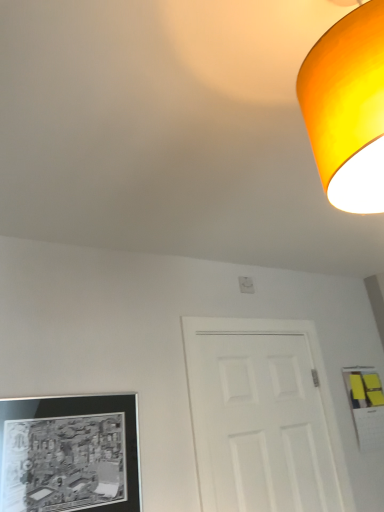
Question: Is point (349, 195) positioned closer to the camera than point (24, 490)?

Choices:
 (A) closer
 (B) farther

Answer: (A)

Question: In the image, is matte orange lampshade at upper right on the left side or the right side of black matte picture frame at lower left?

Choices:
 (A) right
 (B) left

Answer: (A)

Question: Considering the real-world distances, which object is farthest from the black matte picture frame at lower left?

Choices:
 (A) white matte door at center
 (B) matte orange lampshade at upper right

Answer: (B)

Question: Estimate the real-world distances between objects in this image. Which object is closer to the black matte picture frame at lower left?

Choices:
 (A) white matte door at center
 (B) matte orange lampshade at upper right

Answer: (A)